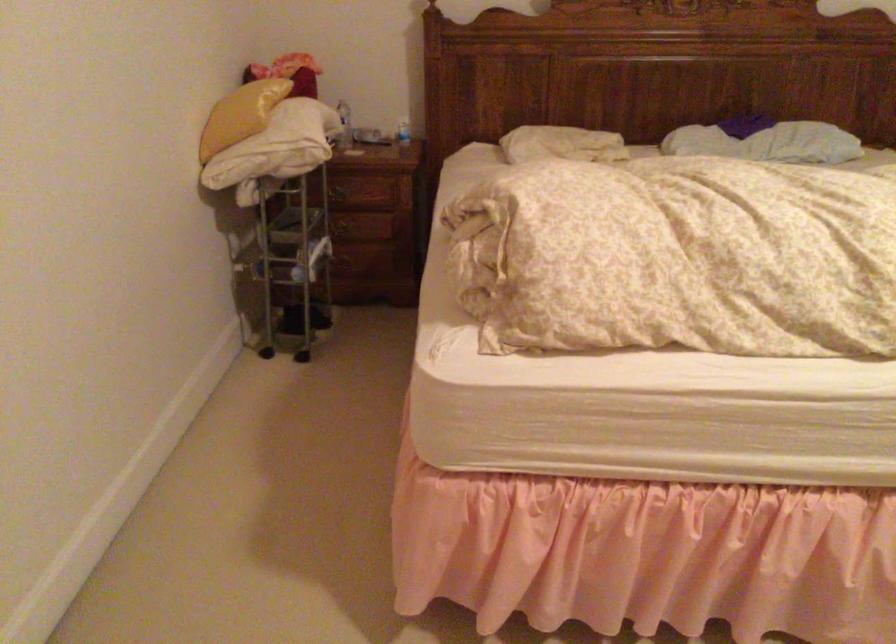
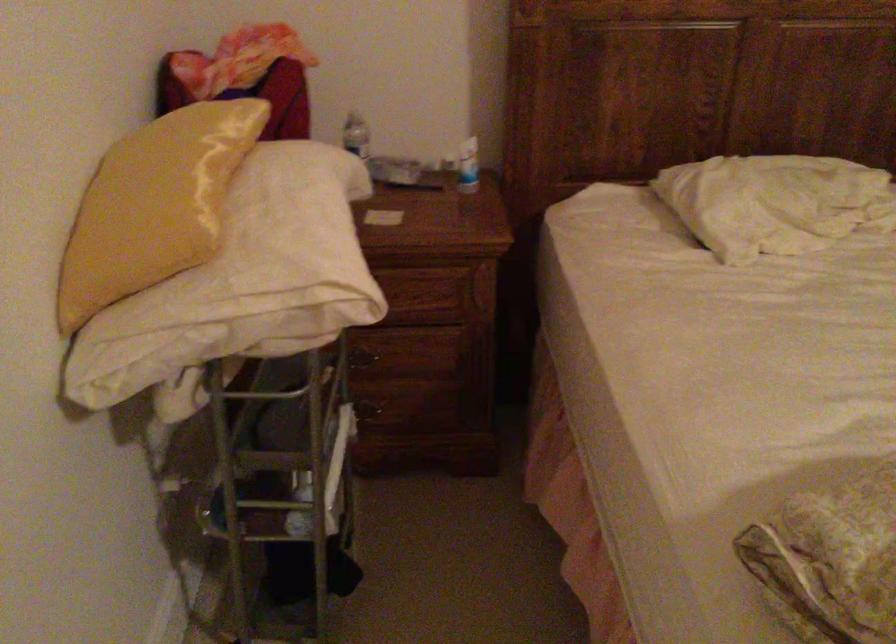
Question: I am providing you with two images of the same scene from different viewpoints. Please identify which objects are invisible in image2.

Choices:
 (A) plastic water bottle
 (B) yellow pillow
 (C) drawer handle
 (D) magazine in rack

Answer: (C)